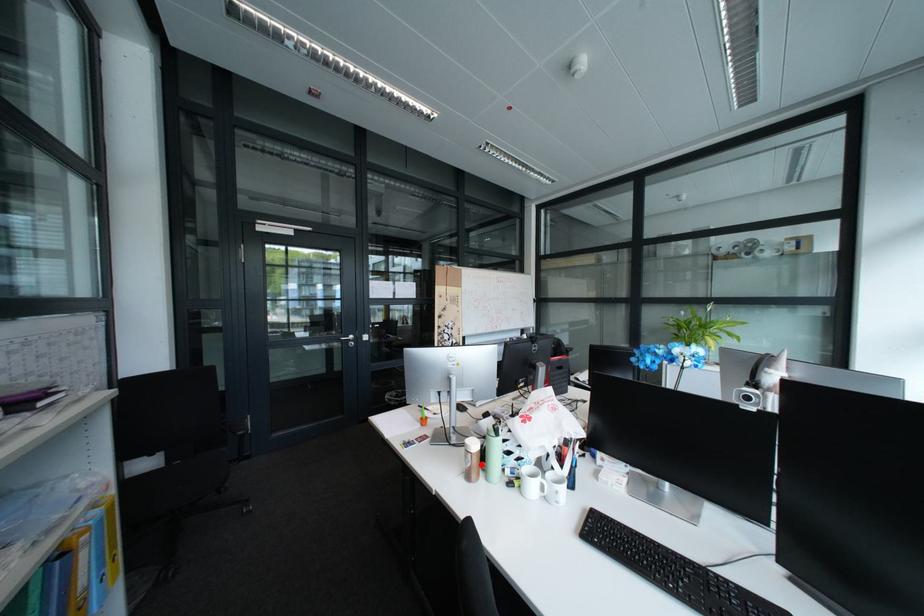
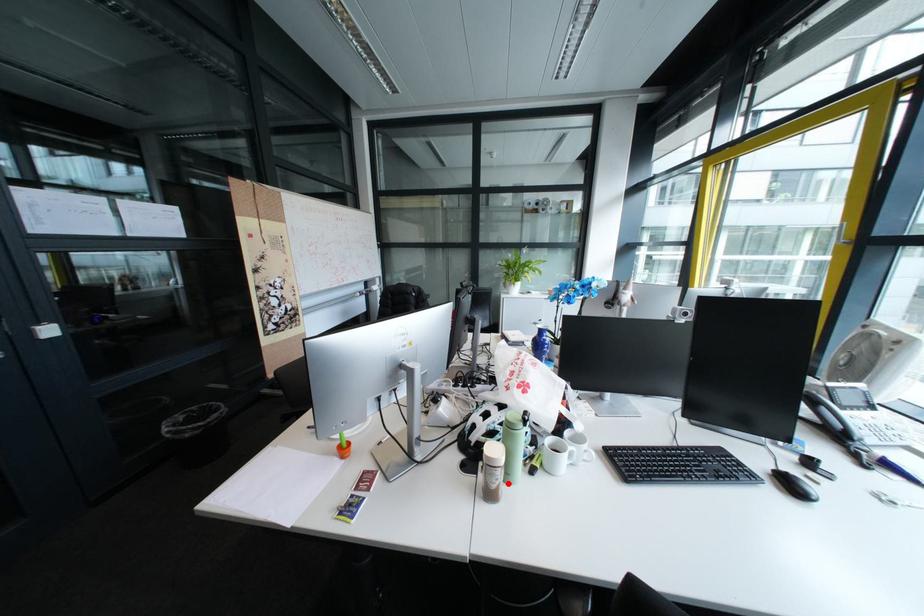
I am providing you with two images of the same scene from different viewpoints. A red point is marked on the first image and another point is marked on the second image. Does the point marked in image1 correspond to the same location as the one in image2?

Yes